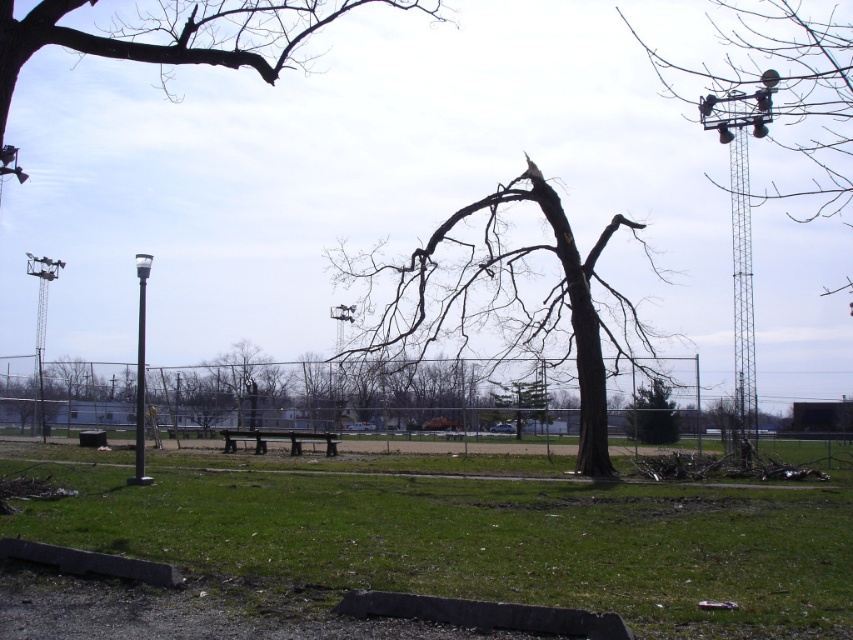
Between point (722, 33) and point (242, 440), which one is positioned in front?

Point (242, 440)

Between metallic gray tower at upper right and brown wooden bench at center, which one is positioned lower?

Positioned lower is brown wooden bench at center.

At what (x,y) coordinates should I click in order to perform the action: click on metallic gray tower at upper right. Please return your answer as a coordinate pair (x, y). The width and height of the screenshot is (853, 640). Looking at the image, I should click on (787, 88).

Who is positioned more to the left, metallic gray tower at upper right or green leafy tree at center?

green leafy tree at center

Which is behind, point (779, 44) or point (647, 397)?

Positioned behind is point (779, 44).

This screenshot has height=640, width=853. Identify the location of metallic gray tower at upper right. (787, 88).

Between green grass at center and dark brown bark tree at center, which one appears on the right side from the viewer's perspective?

From the viewer's perspective, dark brown bark tree at center appears more on the right side.

Based on the photo, is green grass at center further to the viewer compared to dark brown bark tree at center?

No, it is not.

Identify the location of green grass at center. The image size is (853, 640). (465, 532).